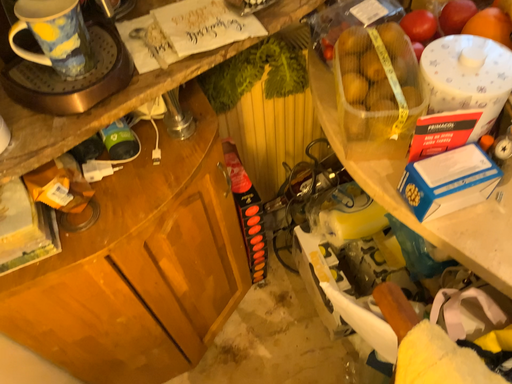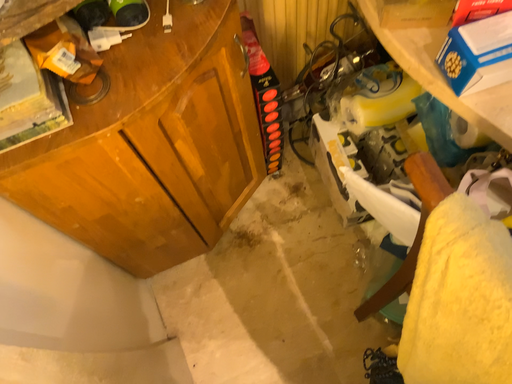
Question: Which way did the camera rotate in the video?

Choices:
 (A) rotated upward
 (B) rotated downward

Answer: (B)